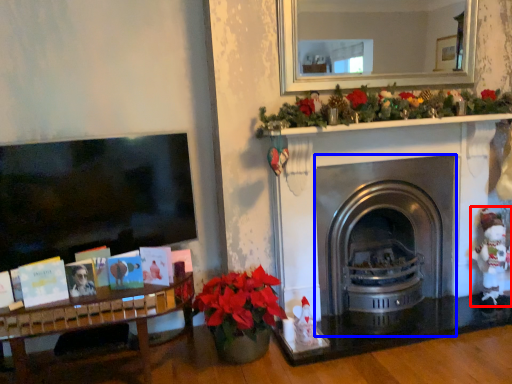
Question: Which object appears farthest to the camera in this image, toy (highlighted by a red box) or fireplace (highlighted by a blue box)?

Choices:
 (A) toy
 (B) fireplace

Answer: (A)